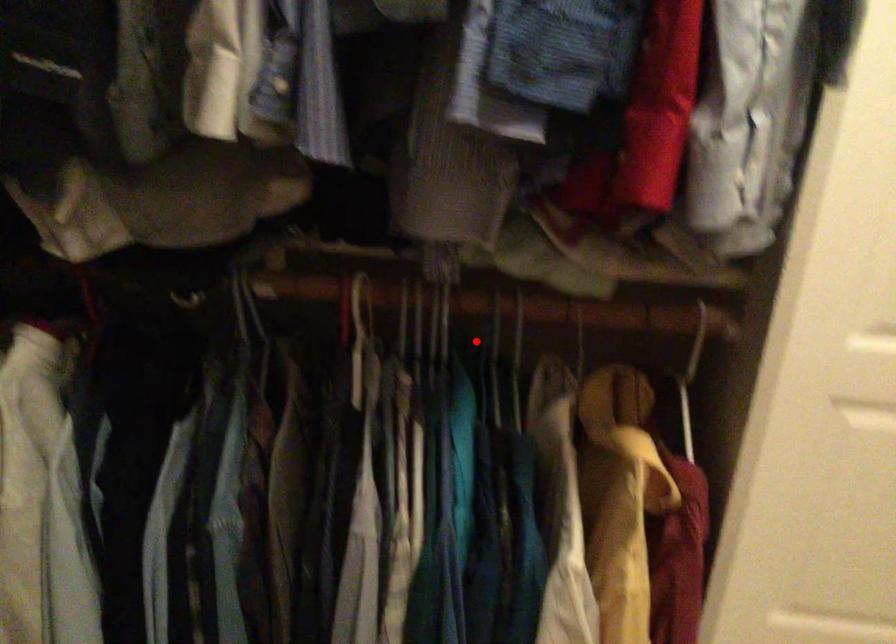
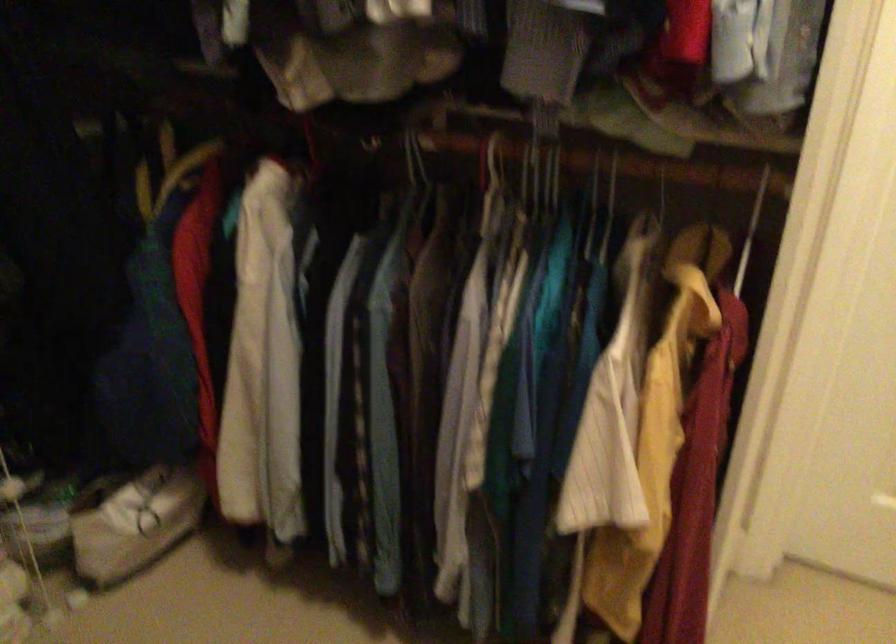
Locate, in the second image, the point that corresponds to the highlighted location in the first image.

(609, 210)